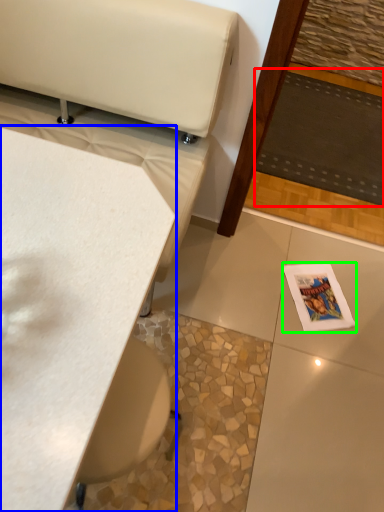
Question: Estimate the real-world distances between objects in this image. Which object is closer to mat (highlighted by a red box), table (highlighted by a blue box) or magazine (highlighted by a green box)?

Choices:
 (A) table
 (B) magazine

Answer: (B)